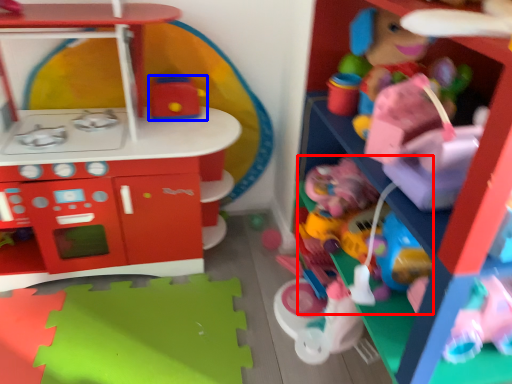
Question: Among these objects, which one is nearest to the camera, toy (highlighted by a red box) or toy (highlighted by a blue box)?

Choices:
 (A) toy
 (B) toy

Answer: (A)